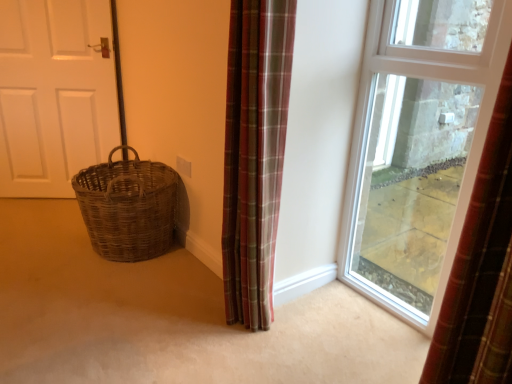
Image resolution: width=512 pixels, height=384 pixels. Identify the location of free region under plaid fabric curtain at center (from a real-world perspective). (243, 312).